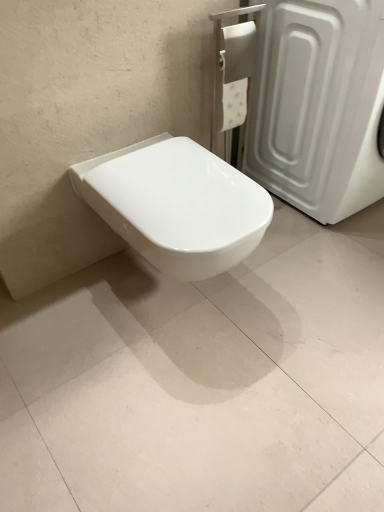
Describe the element at coordinates (176, 205) in the screenshot. This screenshot has width=384, height=512. I see `white glossy toilet at center` at that location.

At what (x,y) coordinates should I click in order to perform the action: click on white plastic screen door at upper right. Please return your answer as a coordinate pair (x, y). Looking at the image, I should click on (319, 105).

Which point is more distant from viewer, (2, 362) or (204, 152)?

The point (2, 362) is more distant.

From a real-world perspective, is white glossy toilet at center under white glossy toilet at center?

Yes, from a real-world perspective, white glossy toilet at center is under white glossy toilet at center.

How many degrees apart are the facing directions of white glossy toilet at center and white glossy toilet at center?

white glossy toilet at center and white glossy toilet at center are facing 89.7 degrees away from each other.

I want to click on toilet on the left of white glossy toilet at center, so [176, 205].

Considering the positions of points (168, 214) and (292, 26), is point (168, 214) farther from camera compared to point (292, 26)?

No.

Would you say white plastic screen door at upper right is part of white glossy toilet at center's contents?

Actually, white plastic screen door at upper right is outside white glossy toilet at center.

From the image's perspective, is white glossy toilet at center located beneath white plastic screen door at upper right?

Yes.

Looking at their sizes, would you say white glossy toilet at center is wider or thinner than white plastic screen door at upper right?

Clearly, white glossy toilet at center has less width compared to white plastic screen door at upper right.

Where is `toilet in front of the white plastic screen door at upper right`? The image size is (384, 512). toilet in front of the white plastic screen door at upper right is located at coordinates (176, 205).

From the image's perspective, which is below, white plastic screen door at upper right or white glossy toilet at center?

From the image's view, white glossy toilet at center is below.

Is white plastic screen door at upper right with white glossy toilet at center?

No, white plastic screen door at upper right is not beside white glossy toilet at center.

Is white plastic screen door at upper right outside of white glossy toilet at center?

white plastic screen door at upper right lies outside white glossy toilet at center's area.

Can white glossy toilet at center be found inside white glossy toilet at center?

No, white glossy toilet at center does not contain white glossy toilet at center.

How many degrees apart are the facing directions of white glossy toilet at center and white glossy toilet at center?

white glossy toilet at center and white glossy toilet at center are facing 89.7 degrees away from each other.

From a real-world perspective, is white glossy toilet at center on top of white glossy toilet at center?

Yes, from a real-world perspective, white glossy toilet at center is on top of white glossy toilet at center.

Consider the image. Is white glossy toilet at center not close to white glossy toilet at center?

white glossy toilet at center is near white glossy toilet at center, not far away.

Can we say white glossy toilet at center lies outside white plastic screen door at upper right?

Yes, white glossy toilet at center is not within white plastic screen door at upper right.

Is point (254, 430) positioned before point (308, 37)?

Yes, it is in front of point (308, 37).

Can you confirm if white glossy toilet at center is wider than white plastic screen door at upper right?

Yes, white glossy toilet at center is wider than white plastic screen door at upper right.

Considering the relative sizes of white glossy toilet at center and white plastic screen door at upper right in the image provided, is white glossy toilet at center taller than white plastic screen door at upper right?

No.

Is white plastic screen door at upper right turned away from white glossy toilet at center?

No, white plastic screen door at upper right is not facing away from white glossy toilet at center.

Consider the image. Considering the sizes of white plastic screen door at upper right and white glossy toilet at center in the image, is white plastic screen door at upper right taller or shorter than white glossy toilet at center?

Clearly, white plastic screen door at upper right is taller compared to white glossy toilet at center.

From a real-world perspective, who is located lower, white plastic screen door at upper right or white glossy toilet at center?

white glossy toilet at center, from a real-world perspective.

In the image, is white plastic screen door at upper right on the left side or the right side of white glossy toilet at center?

Based on their positions, white plastic screen door at upper right is located to the right of white glossy toilet at center.

The width and height of the screenshot is (384, 512). What are the coordinates of `toilet that appears behind the white glossy toilet at center` in the screenshot? It's located at (176, 205).

This screenshot has width=384, height=512. In the image, there is a white plastic screen door at upper right. What are the coordinates of `toilet below it (from the image's perspective)` in the screenshot? It's located at (176, 205).

Which object lies further to the anchor point white glossy toilet at center, white plastic screen door at upper right or white glossy toilet at center?

white plastic screen door at upper right is positioned further to the anchor white glossy toilet at center.

Looking at the image, which one is located further to white glossy toilet at center, white glossy toilet at center or white plastic screen door at upper right?

Based on the image, white plastic screen door at upper right appears to be further to white glossy toilet at center.

From the image, which object appears to be farther from white plastic screen door at upper right, white glossy toilet at center or white glossy toilet at center?

white glossy toilet at center is further to white plastic screen door at upper right.

Looking at the image, which one is located further to white plastic screen door at upper right, white glossy toilet at center or white glossy toilet at center?

white glossy toilet at center lies further to white plastic screen door at upper right than the other object.

In the scene shown: Which object lies further to the anchor point white glossy toilet at center, white glossy toilet at center or white plastic screen door at upper right?

The object further to white glossy toilet at center is white plastic screen door at upper right.

When comparing their distances from white glossy toilet at center, does white plastic screen door at upper right or white glossy toilet at center seem further?

The object further to white glossy toilet at center is white plastic screen door at upper right.

Locate an element on the screen. toilet between white plastic screen door at upper right and white glossy toilet at center in the vertical direction is located at coordinates (176, 205).